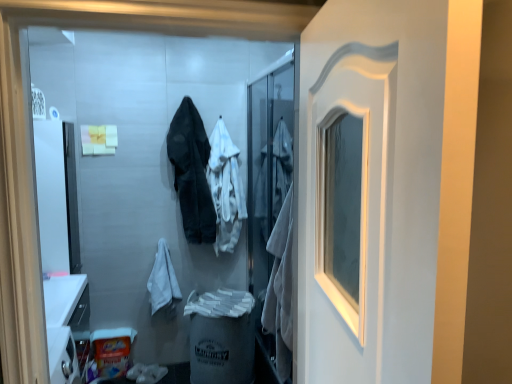
Question: Which direction should I rotate to face dark gray fabric coat at center, the second clothing positioned from the right, — up or down?

Choices:
 (A) down
 (B) up

Answer: (B)

Question: From a real-world perspective, does white matte screen door at center sit lower than dark gray fabric coat at center, positioned as the first clothing in left-to-right order?

Choices:
 (A) yes
 (B) no

Answer: (A)

Question: Is dark gray fabric coat at center, positioned as the first clothing in left-to-right order, at the back of white matte screen door at center?

Choices:
 (A) no
 (B) yes

Answer: (A)

Question: Does white matte screen door at center come behind dark gray fabric coat at center, the second clothing positioned from the right?

Choices:
 (A) yes
 (B) no

Answer: (B)

Question: Can you confirm if white matte screen door at center is wider than dark gray fabric coat at center, positioned as the first clothing in left-to-right order?

Choices:
 (A) yes
 (B) no

Answer: (B)

Question: Is dark gray fabric coat at center, positioned as the first clothing in left-to-right order, a part of white matte screen door at center?

Choices:
 (A) yes
 (B) no

Answer: (B)

Question: From a real-world perspective, is white matte screen door at center positioned over dark gray fabric coat at center, the second clothing positioned from the right, based on gravity?

Choices:
 (A) no
 (B) yes

Answer: (A)

Question: Would you say white matte screen door at center is part of white cotton bathrobe at lower left's contents?

Choices:
 (A) no
 (B) yes

Answer: (A)

Question: Does white cotton bathrobe at lower left turn towards white matte screen door at center?

Choices:
 (A) no
 (B) yes

Answer: (A)

Question: From the image's perspective, is white cotton bathrobe at lower left beneath white matte screen door at center?

Choices:
 (A) no
 (B) yes

Answer: (B)

Question: Is white cotton bathrobe at lower left located outside white matte screen door at center?

Choices:
 (A) yes
 (B) no

Answer: (A)

Question: Can you confirm if white cotton bathrobe at lower left is shorter than white matte screen door at center?

Choices:
 (A) no
 (B) yes

Answer: (B)

Question: Is white cotton bathrobe at lower left oriented away from white matte screen door at center?

Choices:
 (A) yes
 (B) no

Answer: (B)

Question: From a real-world perspective, is dark gray fabric coat at center, the second clothing positioned from the right, located beneath white cotton hoodie at center, the first clothing when ordered from right to left?

Choices:
 (A) no
 (B) yes

Answer: (A)